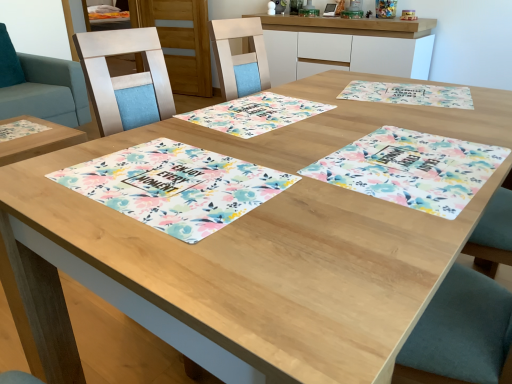
Identify the location of free space below floral fabric placemat at center, which is counted as the 4th place mat, starting from the right (from a real-world perspective). This screenshot has width=512, height=384. (177, 179).